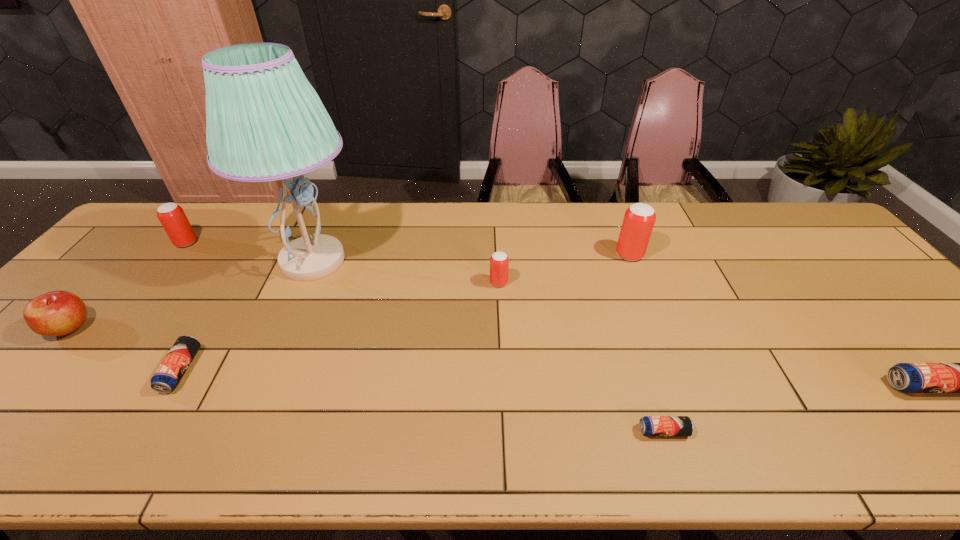
Where is `free area in between the tallest beer can and the tallest object`? The height and width of the screenshot is (540, 960). free area in between the tallest beer can and the tallest object is located at coordinates (471, 258).

This screenshot has height=540, width=960. I want to click on blank region between the fourth beer can from right to left and the nearest object, so click(x=581, y=357).

Identify the location of unoccupied position between the second red beer can from right to left and the smallest blue beer can. Image resolution: width=960 pixels, height=540 pixels. click(581, 357).

Find the location of `free area in between the rightmost red beer can and the second blue beer can from right to left`. free area in between the rightmost red beer can and the second blue beer can from right to left is located at coordinates (646, 343).

Find the location of a particular element. vacant area between the tallest beer can and the third object from left to right is located at coordinates (405, 313).

Image resolution: width=960 pixels, height=540 pixels. Identify the location of unoccupied position between the second tallest beer can and the rightmost red beer can. (408, 249).

Identify the location of object that ranks as the fourth closest to the tallest object. Image resolution: width=960 pixels, height=540 pixels. (499, 262).

Locate which object ranks in proximity to the fifth shortest beer can. Please provide its 2D coordinates. Your answer should be formatted as a tuple, i.e. [(x, y)], where the tuple contains the x and y coordinates of a point satisfying the conditions above.

[(265, 122)]

Locate which beer can ranks third in proximity to the nearest beer can. Please provide its 2D coordinates. Your answer should be formatted as a tuple, i.e. [(x, y)], where the tuple contains the x and y coordinates of a point satisfying the conditions above.

[(639, 219)]

Locate an element on the screen. beer can that is the fourth closest one to the tallest object is located at coordinates (639, 219).